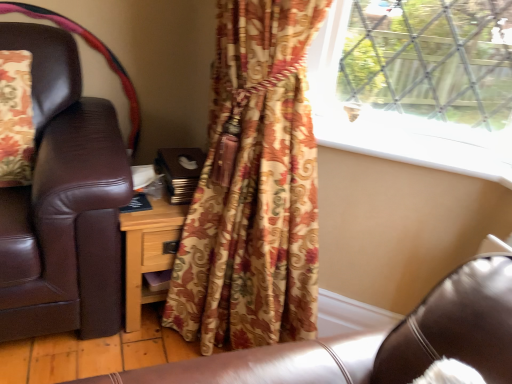
The width and height of the screenshot is (512, 384). What do you see at coordinates (148, 252) in the screenshot? I see `wooden nightstand at center` at bounding box center [148, 252].

At what (x,y) coordinates should I click in order to perform the action: click on floral fabric curtain at center. Please return your answer as a coordinate pair (x, y). The height and width of the screenshot is (384, 512). Looking at the image, I should click on coord(253,187).

Identify the location of white smooth window sill at upper center. (416, 150).

At what (x,y) coordinates should I click in order to perform the action: click on window sill behind the floral fabric curtain at center. Please return your answer as a coordinate pair (x, y). Looking at the image, I should click on (416, 150).

Considering the positions of point (376, 132) and point (234, 71), is point (376, 132) closer or farther from the camera than point (234, 71)?

Point (376, 132) appears to be farther away from the viewer than point (234, 71).

Locate an element on the screen. The image size is (512, 384). curtain lying above the wooden nightstand at center (from the image's perspective) is located at coordinates (253, 187).

Is wooden nightstand at center located outside floral fabric curtain at center?

No, wooden nightstand at center is inside or overlapping with floral fabric curtain at center.

Who is smaller, wooden nightstand at center or floral fabric curtain at center?

With smaller size is wooden nightstand at center.

Considering their positions, is white smooth window sill at upper center located in front of or behind wooden nightstand at center?

white smooth window sill at upper center is in front of wooden nightstand at center.

From the image's perspective, is white smooth window sill at upper center above wooden nightstand at center?

Correct, white smooth window sill at upper center appears higher than wooden nightstand at center in the image.

Based on the photo, is white smooth window sill at upper center bigger or smaller than wooden nightstand at center?

Clearly, white smooth window sill at upper center is smaller in size than wooden nightstand at center.

From the image's perspective, who appears lower, wooden nightstand at center or white smooth window sill at upper center?

wooden nightstand at center.

Is wooden nightstand at center at the left side of white smooth window sill at upper center?

Yes, wooden nightstand at center is to the left of white smooth window sill at upper center.

Which of these two, wooden nightstand at center or white smooth window sill at upper center, stands taller?

wooden nightstand at center.

Does floral fabric curtain at center touch wooden nightstand at center?

floral fabric curtain at center and wooden nightstand at center are clearly separated.

Is floral fabric curtain at center taller or shorter than wooden nightstand at center?

In the image, floral fabric curtain at center appears to be taller than wooden nightstand at center.

Between floral fabric curtain at center and wooden nightstand at center, which one has smaller width?

wooden nightstand at center.

Considering the relative positions of floral fabric curtain at center and wooden nightstand at center in the image provided, is floral fabric curtain at center to the right of wooden nightstand at center from the viewer's perspective?

Indeed, floral fabric curtain at center is positioned on the right side of wooden nightstand at center.

From a real-world perspective, which object stands above the other?

In real-world perspective, white smooth window sill at upper center is above.

Can we say floral fabric curtain at center lies outside white smooth window sill at upper center?

Absolutely, floral fabric curtain at center is external to white smooth window sill at upper center.

How many degrees apart are the facing directions of floral fabric curtain at center and white smooth window sill at upper center?

18.1 degrees.

Locate an element on the screen. The width and height of the screenshot is (512, 384). window sill behind the floral fabric curtain at center is located at coordinates (416, 150).

Find the location of a particular element. This screenshot has width=512, height=384. curtain located below the white smooth window sill at upper center (from the image's perspective) is located at coordinates (253, 187).

Where is `curtain above the wooden nightstand at center (from the image's perspective)`? Image resolution: width=512 pixels, height=384 pixels. curtain above the wooden nightstand at center (from the image's perspective) is located at coordinates (253, 187).

When comparing their distances from floral fabric curtain at center, does white smooth window sill at upper center or wooden nightstand at center seem closer?

The object closer to floral fabric curtain at center is wooden nightstand at center.

Looking at the image, which one is located further to wooden nightstand at center, floral fabric curtain at center or white smooth window sill at upper center?

white smooth window sill at upper center is positioned further to the anchor wooden nightstand at center.

Estimate the real-world distances between objects in this image. Which object is further from wooden nightstand at center, white smooth window sill at upper center or floral fabric curtain at center?

Based on the image, white smooth window sill at upper center appears to be further to wooden nightstand at center.

Based on their spatial positions, is wooden nightstand at center or white smooth window sill at upper center closer to floral fabric curtain at center?

wooden nightstand at center is positioned closer to the anchor floral fabric curtain at center.

Which object lies further to the anchor point white smooth window sill at upper center, wooden nightstand at center or floral fabric curtain at center?

wooden nightstand at center is positioned further to the anchor white smooth window sill at upper center.

Which object lies further to the anchor point white smooth window sill at upper center, floral fabric curtain at center or wooden nightstand at center?

The object further to white smooth window sill at upper center is wooden nightstand at center.

The image size is (512, 384). I want to click on curtain between wooden nightstand at center and white smooth window sill at upper center from left to right, so click(x=253, y=187).